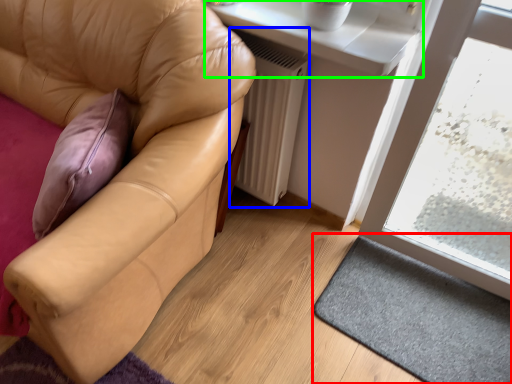
Question: Which object is positioned closest to doormat (highlighted by a red box)? Select from radiator (highlighted by a blue box) and window sill (highlighted by a green box).

Choices:
 (A) radiator
 (B) window sill

Answer: (A)